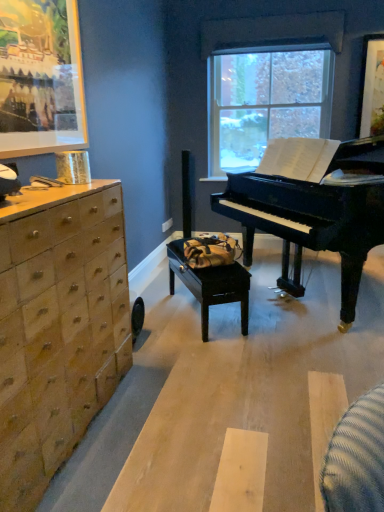
Identify the location of black wood table at center. (210, 285).

The height and width of the screenshot is (512, 384). What do you see at coordinates (58, 329) in the screenshot? I see `wooden chest of drawers at left` at bounding box center [58, 329].

I want to click on black polished piano at center, so click(316, 215).

The image size is (384, 512). What do you see at coordinates (267, 83) in the screenshot? I see `clear glass window at center` at bounding box center [267, 83].

Identify the location of black wood table at center. (210, 285).

Which is less distant, [175,241] or [280,57]?

Clearly, point [175,241] is more distant from the camera than point [280,57].

Considering the positions of objects black wood table at center and clear glass window at center in the image provided, who is more to the right, black wood table at center or clear glass window at center?

clear glass window at center is more to the right.

How many degrees apart are the facing directions of black wood table at center and clear glass window at center?

The angular difference between black wood table at center and clear glass window at center is 121 degrees.

Can you confirm if black wood table at center is bigger than clear glass window at center?

Yes, black wood table at center is bigger than clear glass window at center.

Which is more to the right, clear glass window at center or black polished piano at center?

From the viewer's perspective, black polished piano at center appears more on the right side.

You are a GUI agent. You are given a task and a screenshot of the screen. Output one action in this format:
    pyautogui.click(x=<x>, y=<y>)
    Task: Click on the piano below the clear glass window at center (from the image's perspective)
    
    Given the screenshot: What is the action you would take?
    pyautogui.click(x=316, y=215)

Is clear glass window at center facing towards black polished piano at center?

Yes, clear glass window at center is aimed at black polished piano at center.

Is black polished piano at center far from clear glass window at center?

Yes, black polished piano at center and clear glass window at center are quite far apart.

The image size is (384, 512). I want to click on window above the black polished piano at center (from the image's perspective), so click(x=267, y=83).

From a real-world perspective, which is physically above, black polished piano at center or clear glass window at center?

From a 3D spatial view, clear glass window at center is above.

Considering the relative positions of black polished piano at center and clear glass window at center in the image provided, is black polished piano at center to the right of clear glass window at center from the viewer's perspective?

Yes, black polished piano at center is to the right of clear glass window at center.

Can we say black polished piano at center lies outside black wood table at center?

black polished piano at center is positioned outside black wood table at center.

Between black polished piano at center and black wood table at center, which one is positioned in front?

Positioned in front is black polished piano at center.

Is black polished piano at center positioned far away from black wood table at center?

black polished piano at center is near black wood table at center, not far away.

The image size is (384, 512). I want to click on piano that is on the right side of black wood table at center, so click(x=316, y=215).

Is wooden chest of drawers at left to the left of black wood table at center from the viewer's perspective?

Yes, wooden chest of drawers at left is to the left of black wood table at center.

Would you say wooden chest of drawers at left is a long distance from black wood table at center?

wooden chest of drawers at left is far away from black wood table at center.

What's the angular difference between wooden chest of drawers at left and black wood table at center's facing directions?

They differ by 30.8 degrees in their facing directions.

Is wooden chest of drawers at left inside the boundaries of black wood table at center, or outside?

wooden chest of drawers at left is not enclosed by black wood table at center.

Are clear glass window at center and black wood table at center making contact?

No.

Is point (315, 102) positioned before point (202, 340)?

No, (315, 102) is behind (202, 340).

From their relative heights in the image, would you say clear glass window at center is taller or shorter than black wood table at center?

In the image, clear glass window at center appears to be taller than black wood table at center.

Is black wood table at center completely or partially outside of black polished piano at center?

black wood table at center lies outside black polished piano at center's area.

Does black wood table at center have a lesser width compared to black polished piano at center?

Indeed, black wood table at center has a lesser width compared to black polished piano at center.

You are a GUI agent. You are given a task and a screenshot of the screen. Output one action in this format:
    pyautogui.click(x=<x>, y=<y>)
    Task: Click on the piano lying in front of the black wood table at center
    Image resolution: width=384 pixels, height=512 pixels.
    Given the screenshot: What is the action you would take?
    pyautogui.click(x=316, y=215)

Which is closer to the camera, [203,270] or [380,210]?

The point [380,210] is closer to the camera.

In the image, there is a clear glass window at center. Where is `table below it (from the image's perspective)`? table below it (from the image's perspective) is located at coordinates (x=210, y=285).

This screenshot has width=384, height=512. In order to click on window that is behind the black polished piano at center in this screenshot , I will do `click(267, 83)`.

When comparing their distances from clear glass window at center, does black polished piano at center or wooden chest of drawers at left seem further?

The object further to clear glass window at center is wooden chest of drawers at left.

When comparing their distances from wooden chest of drawers at left, does clear glass window at center or black polished piano at center seem further?

The object further to wooden chest of drawers at left is clear glass window at center.

Estimate the real-world distances between objects in this image. Which object is closer to wooden chest of drawers at left, black wood table at center or black polished piano at center?

Among the two, black wood table at center is located nearer to wooden chest of drawers at left.

In the scene shown: Considering their positions, is clear glass window at center positioned closer to wooden chest of drawers at left than black wood table at center?

black wood table at center.

When comparing their distances from clear glass window at center, does black wood table at center or wooden chest of drawers at left seem further?

wooden chest of drawers at left is positioned further to the anchor clear glass window at center.

When comparing their distances from black wood table at center, does black polished piano at center or clear glass window at center seem closer?

Based on the image, black polished piano at center appears to be nearer to black wood table at center.

Estimate the real-world distances between objects in this image. Which object is closer to clear glass window at center, wooden chest of drawers at left or black polished piano at center?

The object closer to clear glass window at center is black polished piano at center.

From the image, which object appears to be farther from clear glass window at center, black wood table at center or black polished piano at center?

black wood table at center lies further to clear glass window at center than the other object.

The height and width of the screenshot is (512, 384). Find the location of `table positioned between wooden chest of drawers at left and clear glass window at center from near to far`. table positioned between wooden chest of drawers at left and clear glass window at center from near to far is located at coordinates (210, 285).

Image resolution: width=384 pixels, height=512 pixels. In order to click on table between black polished piano at center and clear glass window at center along the z-axis in this screenshot , I will do point(210,285).

This screenshot has width=384, height=512. I want to click on table between wooden chest of drawers at left and black polished piano at center from left to right, so click(x=210, y=285).

The height and width of the screenshot is (512, 384). Identify the location of piano between wooden chest of drawers at left and clear glass window at center from front to back. (316, 215).